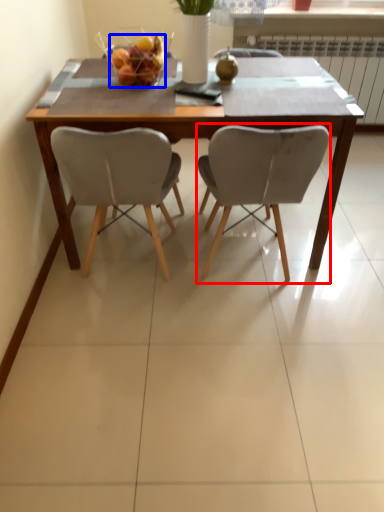
Question: Which object appears farthest to the camera in this image, chair (highlighted by a red box) or fruit dish (highlighted by a blue box)?

Choices:
 (A) chair
 (B) fruit dish

Answer: (B)